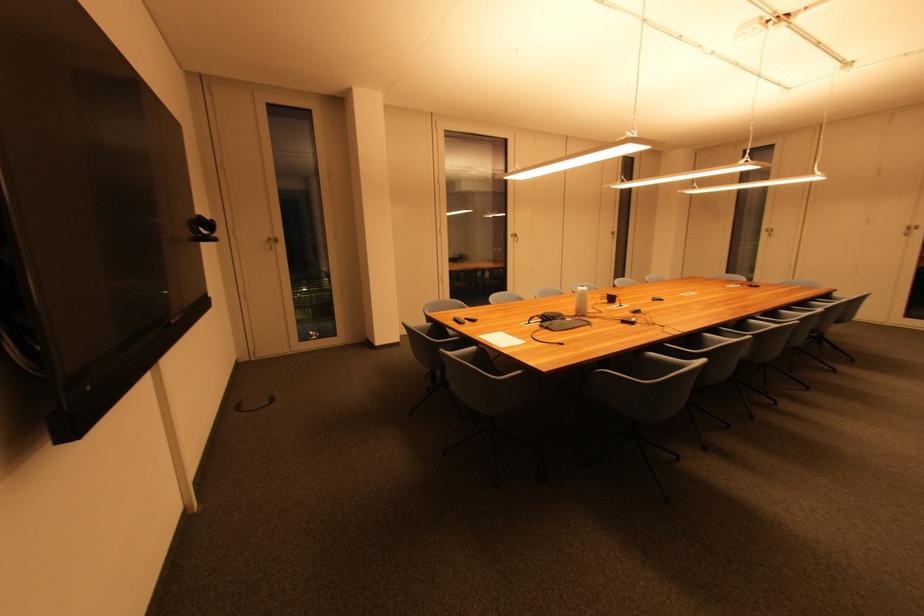
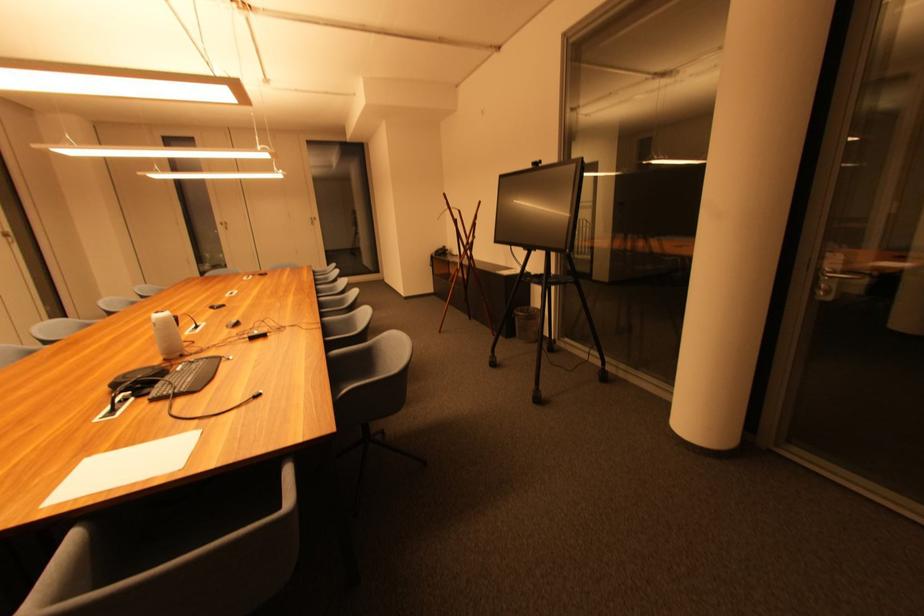
In the second image, find the point that corresponds to (479,350) in the first image.

(80, 538)